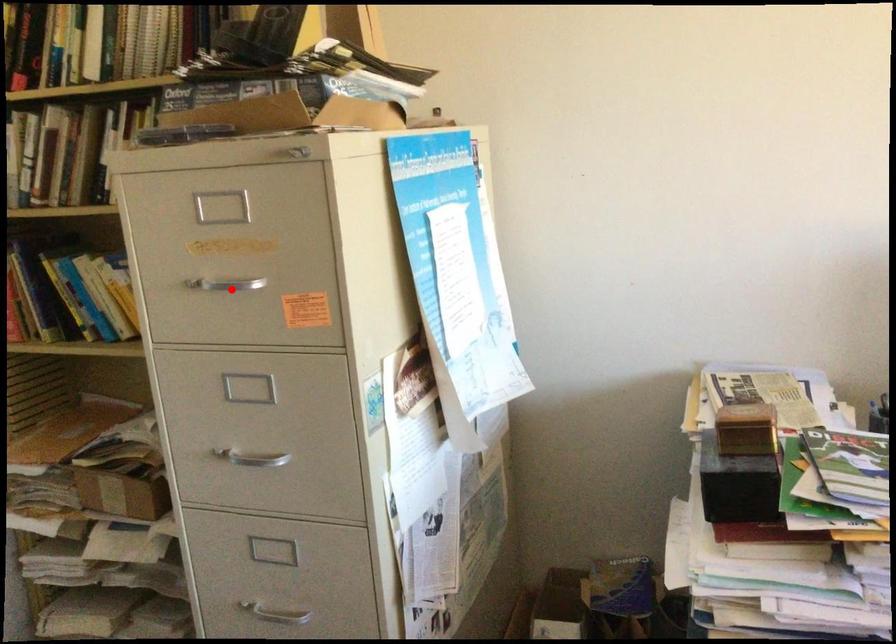
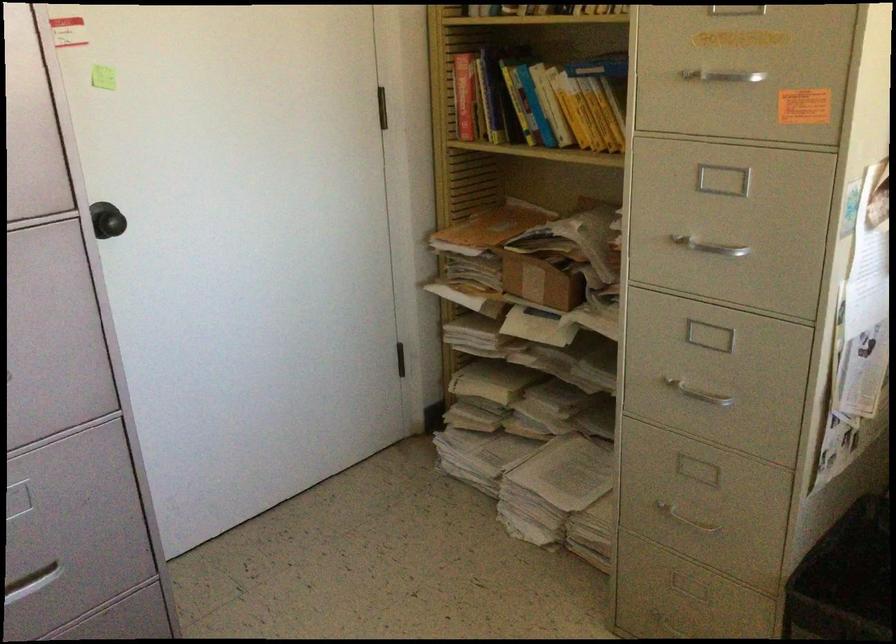
Locate, in the second image, the point that corresponds to the highlighted location in the first image.

(725, 82)